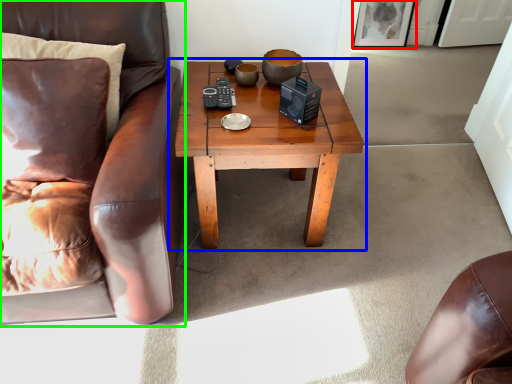
Question: Estimate the real-world distances between objects in this image. Which object is farther from picture frame (highlighted by a red box), coffee table (highlighted by a blue box) or chair (highlighted by a green box)?

Choices:
 (A) coffee table
 (B) chair

Answer: (B)